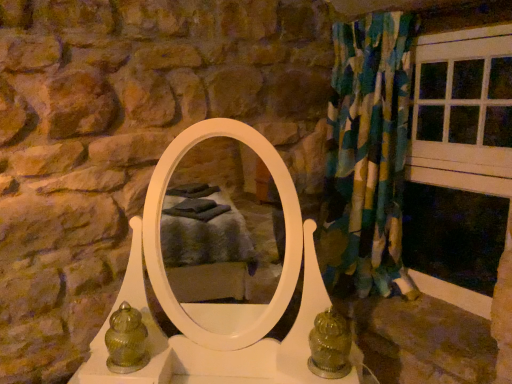
Question: From a real-world perspective, relative to textured fabric curtain at right, is green glass vase at lower left vertically above or below?

Choices:
 (A) above
 (B) below

Answer: (B)

Question: Is point (106, 365) positioned closer to the camera than point (394, 119)?

Choices:
 (A) closer
 (B) farther

Answer: (A)

Question: Estimate the real-world distances between objects in this image. Which object is closer to the green glass vase at lower left?

Choices:
 (A) textured fabric curtain at right
 (B) white wood window frame at right

Answer: (A)

Question: Estimate the real-world distances between objects in this image. Which object is closer to the green glass vase at lower left?

Choices:
 (A) textured fabric curtain at right
 (B) white wood window frame at right

Answer: (A)